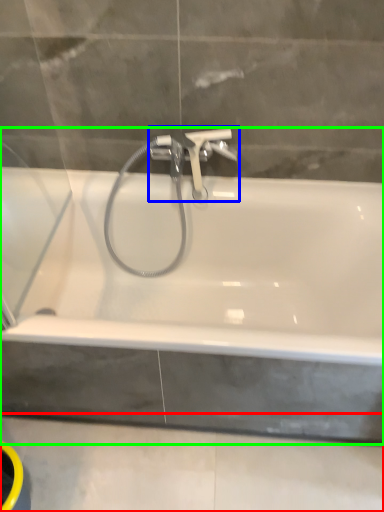
Question: Which is nearer to the concrete (highlighted by a red box)? tap (highlighted by a blue box) or bathtub (highlighted by a green box).

Choices:
 (A) tap
 (B) bathtub

Answer: (B)